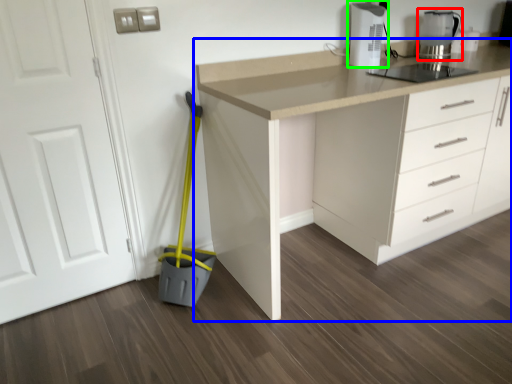
Question: Which is nearer to the kitchen appliance (highlighted by a red box)? countertop (highlighted by a blue box) or home appliance (highlighted by a green box).

Choices:
 (A) countertop
 (B) home appliance

Answer: (B)